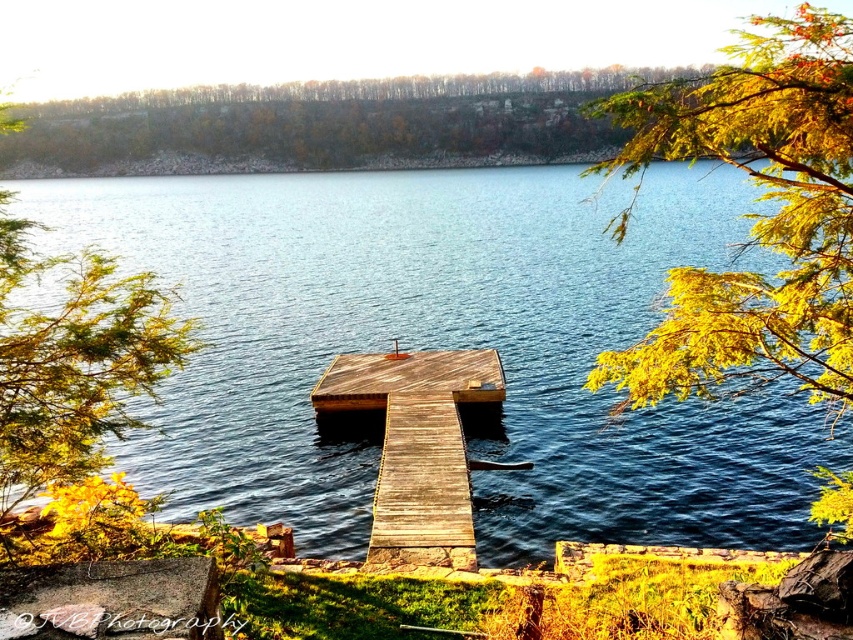
Question: Which object appears farthest from the camera in this image?

Choices:
 (A) yellow-green leaves at upper right
 (B) green leafy tree at left

Answer: (B)

Question: Estimate the real-world distances between objects in this image. Which object is closer to the blue water at center?

Choices:
 (A) weathered wood dock at center
 (B) yellow-green leaves at upper right
 (C) green leafy tree at left

Answer: (B)

Question: Is blue water at center to the left of green leafy tree at left from the viewer's perspective?

Choices:
 (A) yes
 (B) no

Answer: (B)

Question: Can you confirm if green leafy tree at left is bigger than weathered wood dock at center?

Choices:
 (A) no
 (B) yes

Answer: (B)

Question: Which object is closer to the camera taking this photo?

Choices:
 (A) weathered wood dock at center
 (B) green leafy tree at left
 (C) yellow-green leaves at upper right

Answer: (C)

Question: Can you confirm if green leafy tree at left is positioned below weathered wood dock at center?

Choices:
 (A) yes
 (B) no

Answer: (B)